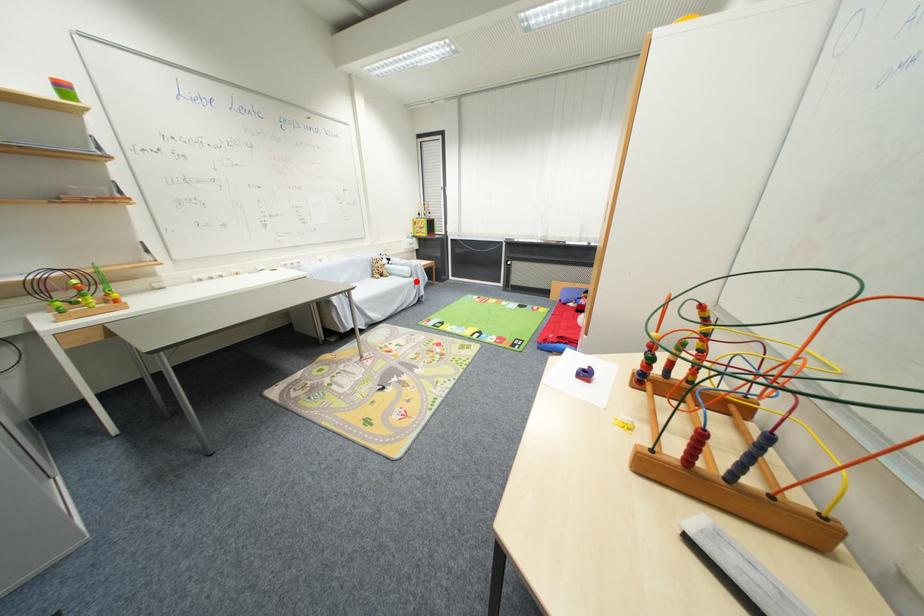
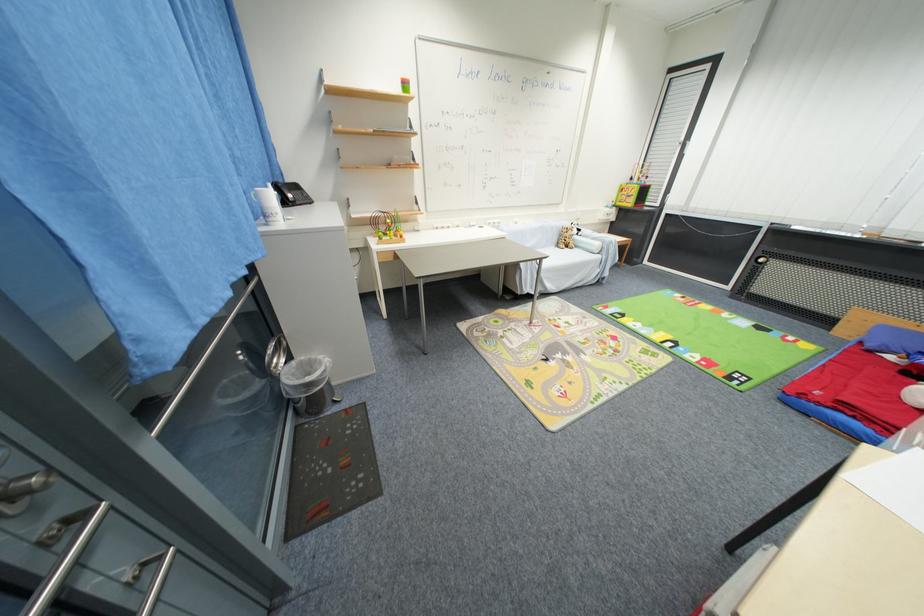
Question: I am providing you with two images of the same scene from different viewpoints. A red point is shown in image1. For the corresponding object point in image2, is it positioned nearer or farther from the camera?

Choices:
 (A) Nearer
 (B) Farther

Answer: (B)